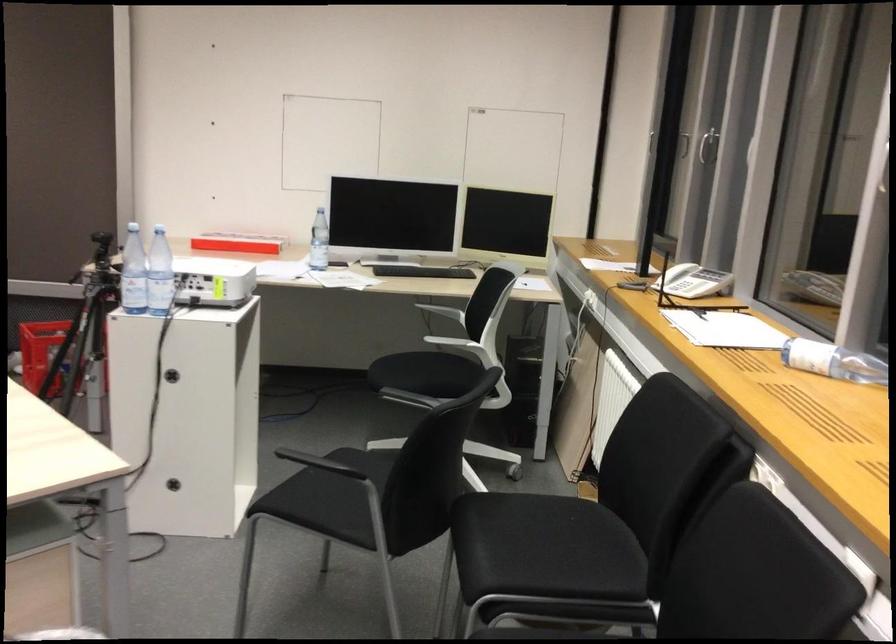
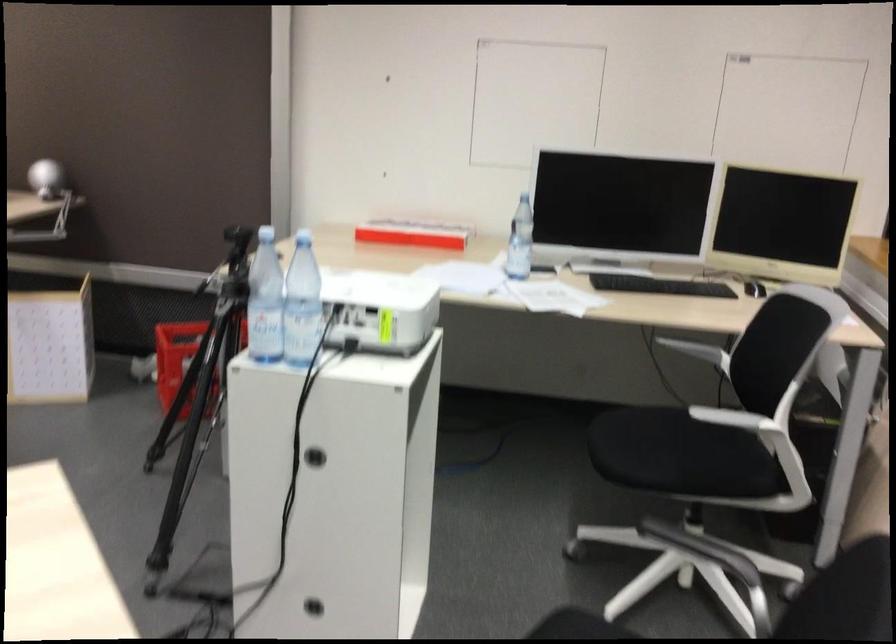
Locate, in the second image, the point that corresponds to point (176, 486) in the first image.

(313, 607)